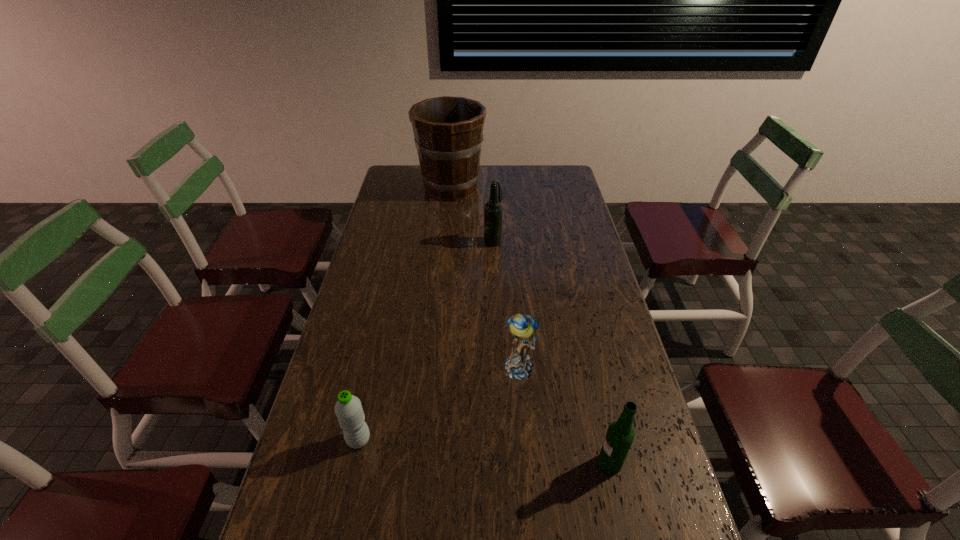
At what (x,y) coordinates should I click in order to perform the action: click on object present at the far left corner. Please return your answer as a coordinate pair (x, y). The image size is (960, 540). Looking at the image, I should click on (448, 131).

This screenshot has height=540, width=960. In the image, there is a desktop. In order to click on vacant space at the far edge in this screenshot , I will do `click(483, 189)`.

You are a GUI agent. You are given a task and a screenshot of the screen. Output one action in this format:
    pyautogui.click(x=<x>, y=<y>)
    Task: Click on the vacant space at the left edge
    This screenshot has width=960, height=540.
    Given the screenshot: What is the action you would take?
    pyautogui.click(x=395, y=261)

The image size is (960, 540). In the image, there is a desktop. In order to click on vacant space at the right edge in this screenshot , I will do `click(584, 260)`.

Image resolution: width=960 pixels, height=540 pixels. In order to click on vacant region at the far right corner in this screenshot , I will do `click(538, 171)`.

You are a GUI agent. You are given a task and a screenshot of the screen. Output one action in this format:
    pyautogui.click(x=<x>, y=<y>)
    Task: Click on the free point between the bucket and the second farthest object
    The image size is (960, 540).
    Given the screenshot: What is the action you would take?
    pyautogui.click(x=472, y=214)

This screenshot has height=540, width=960. In order to click on empty space that is in between the water bottle and the farthest object in this screenshot , I will do `click(405, 314)`.

Locate an element on the screen. vacant area between the fourth nearest object and the farthest object is located at coordinates (472, 214).

Locate an element on the screen. vacant space that is in between the parrot and the bucket is located at coordinates (486, 278).

Locate an element on the screen. Image resolution: width=960 pixels, height=540 pixels. free space between the water bottle and the farthest object is located at coordinates (405, 314).